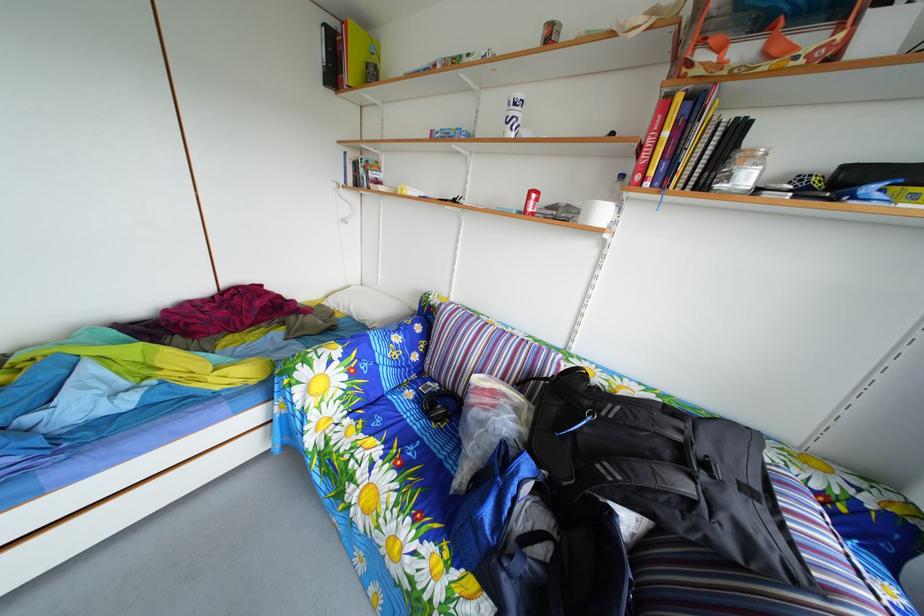
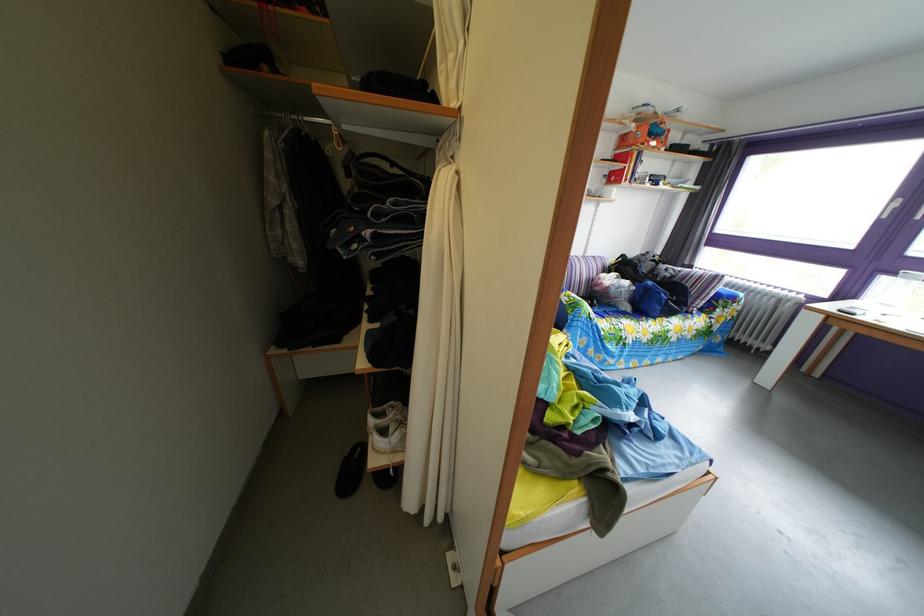
The point at (639,176) is marked in the first image. Where is the corresponding point in the second image?

(618, 180)